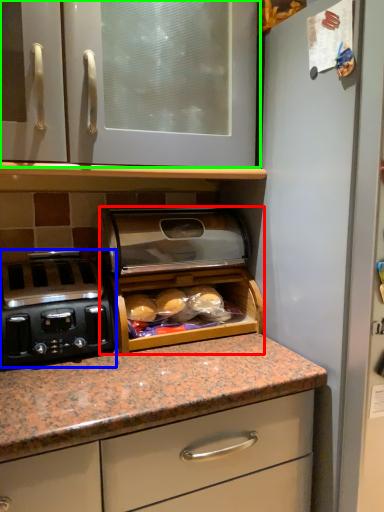
Question: Considering the real-world distances, which object is closest to appliance (highlighted by a red box)? home appliance (highlighted by a blue box) or cabinetry (highlighted by a green box).

Choices:
 (A) home appliance
 (B) cabinetry

Answer: (A)